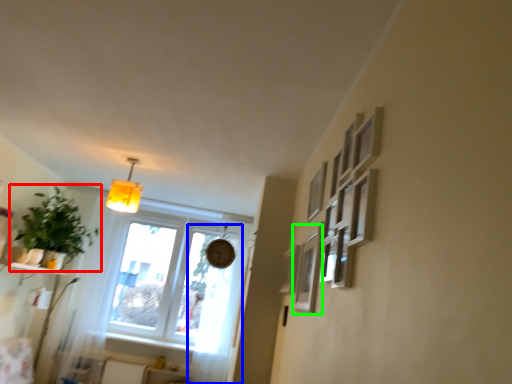
Question: Which object is positioned closest to houseplant (highlighted by a red box)? Select from curtain (highlighted by a blue box) and picture frame (highlighted by a green box).

Choices:
 (A) curtain
 (B) picture frame

Answer: (A)